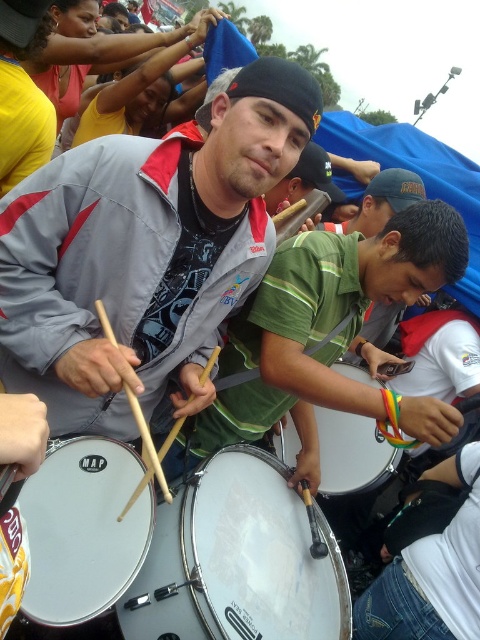
Based on the scene description, where is the white glossy drum at center located in terms of coordinates?

The white glossy drum at center is located at coordinates point (237, 561).

You are a photographer at the event and want to capture a photo where the white glossy drum at center is visible above the green matte shirt at center. Is this possible given their current positions?

The white glossy drum at center is currently below the green matte shirt at center, so it would not be visible above it in the current arrangement.